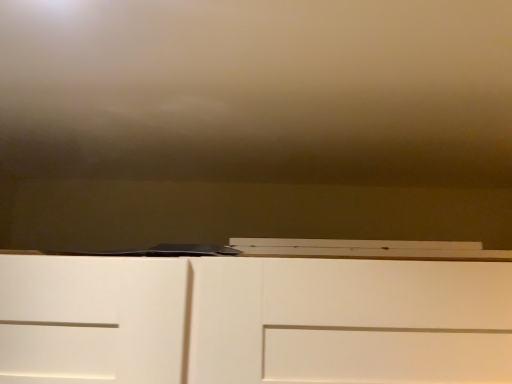
Question: Should I look upward or downward to see matte brown wall at upper center?

Choices:
 (A) up
 (B) down

Answer: (A)